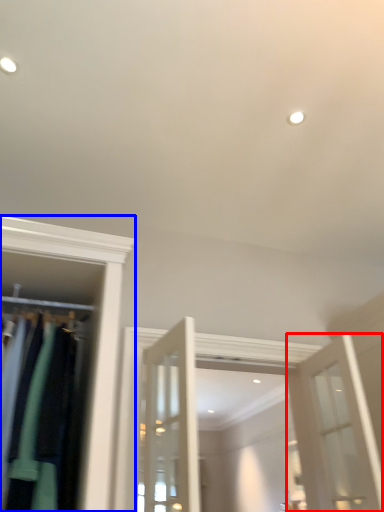
Question: Which point is further to the camera, door (highlighted by a red box) or closet (highlighted by a blue box)?

Choices:
 (A) door
 (B) closet

Answer: (A)